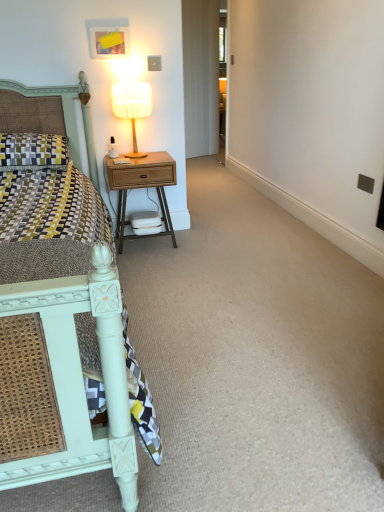
Question: Considering the relative sizes of white fabric lampshade at upper right and patterned fabric pillow at left in the image provided, is white fabric lampshade at upper right thinner than patterned fabric pillow at left?

Choices:
 (A) yes
 (B) no

Answer: (A)

Question: Is white fabric lampshade at upper right bigger than patterned fabric pillow at left?

Choices:
 (A) yes
 (B) no

Answer: (B)

Question: Is white fabric lampshade at upper right wider than patterned fabric pillow at left?

Choices:
 (A) yes
 (B) no

Answer: (B)

Question: From a real-world perspective, does white fabric lampshade at upper right stand above patterned fabric pillow at left?

Choices:
 (A) no
 (B) yes

Answer: (B)

Question: From the image's perspective, is white fabric lampshade at upper right above patterned fabric pillow at left?

Choices:
 (A) yes
 (B) no

Answer: (A)

Question: Is matte white bed at left in front of or behind woodenmaterial/texturenightstand at left in the image?

Choices:
 (A) behind
 (B) front

Answer: (B)

Question: In terms of size, does matte white bed at left appear bigger or smaller than woodenmaterial/texturenightstand at left?

Choices:
 (A) small
 (B) big

Answer: (B)

Question: From the image's perspective, is matte white bed at left located above or below woodenmaterial/texturenightstand at left?

Choices:
 (A) below
 (B) above

Answer: (A)

Question: In terms of height, does matte white bed at left look taller or shorter compared to woodenmaterial/texturenightstand at left?

Choices:
 (A) tall
 (B) short

Answer: (A)

Question: Would you say matte white bed at left is to the left or to the right of patterned fabric pillow at left in the picture?

Choices:
 (A) right
 (B) left

Answer: (A)

Question: In terms of height, does matte white bed at left look taller or shorter compared to patterned fabric pillow at left?

Choices:
 (A) tall
 (B) short

Answer: (A)

Question: From the image's perspective, is matte white bed at left positioned above or below patterned fabric pillow at left?

Choices:
 (A) below
 (B) above

Answer: (A)

Question: From a real-world perspective, is matte white bed at left positioned above or below patterned fabric pillow at left?

Choices:
 (A) below
 (B) above

Answer: (A)

Question: Is patterned fabric pillow at left to the left or to the right of woodenmaterial/texturenightstand at left in the image?

Choices:
 (A) right
 (B) left

Answer: (B)

Question: From a real-world perspective, relative to woodenmaterial/texturenightstand at left, is patterned fabric pillow at left vertically above or below?

Choices:
 (A) above
 (B) below

Answer: (A)